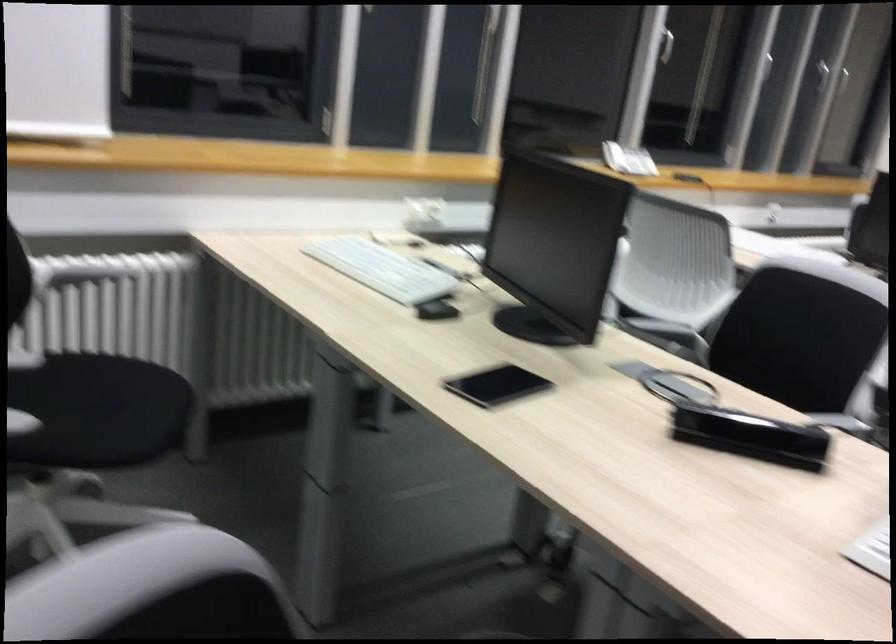
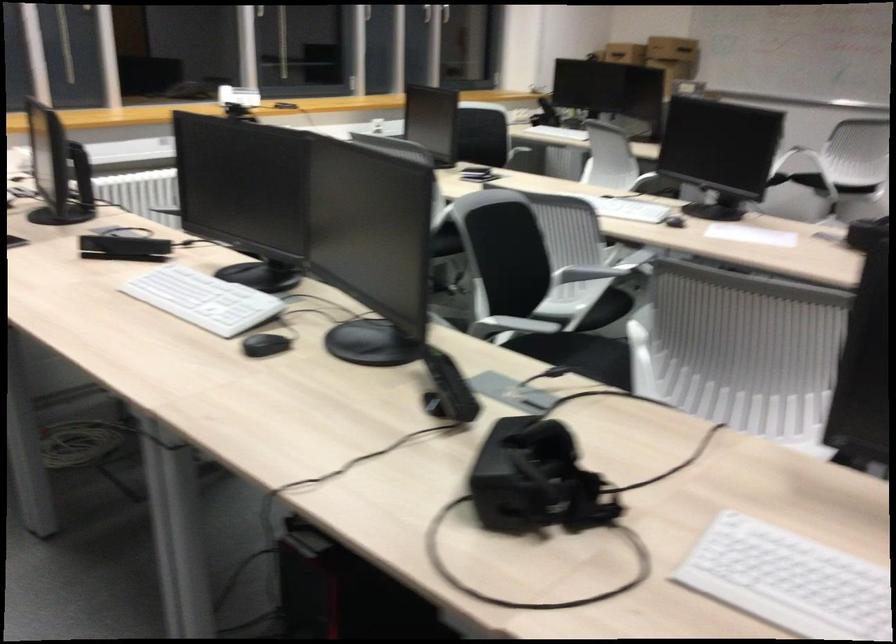
Find the pixel in the second image that matches point 616,144 in the first image.

(238, 96)